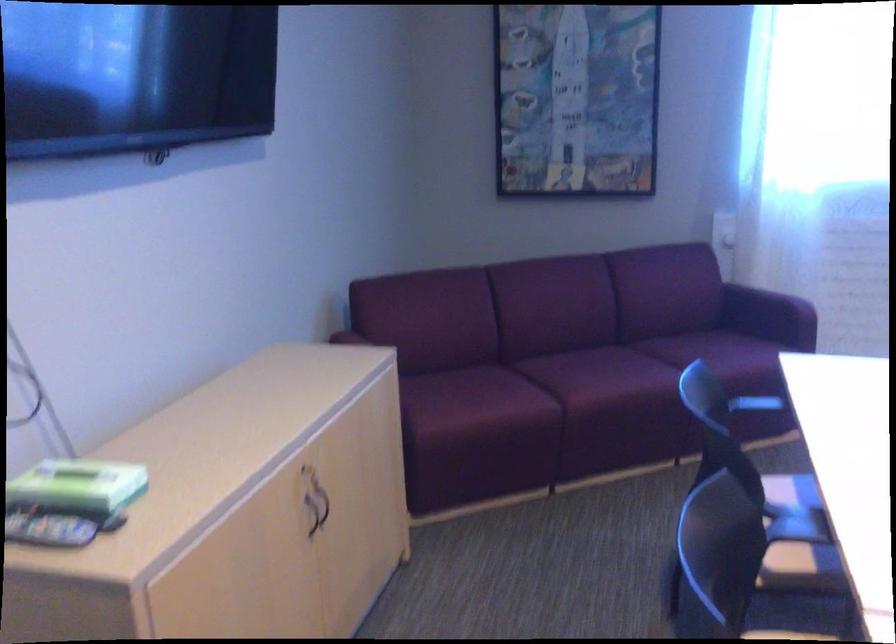
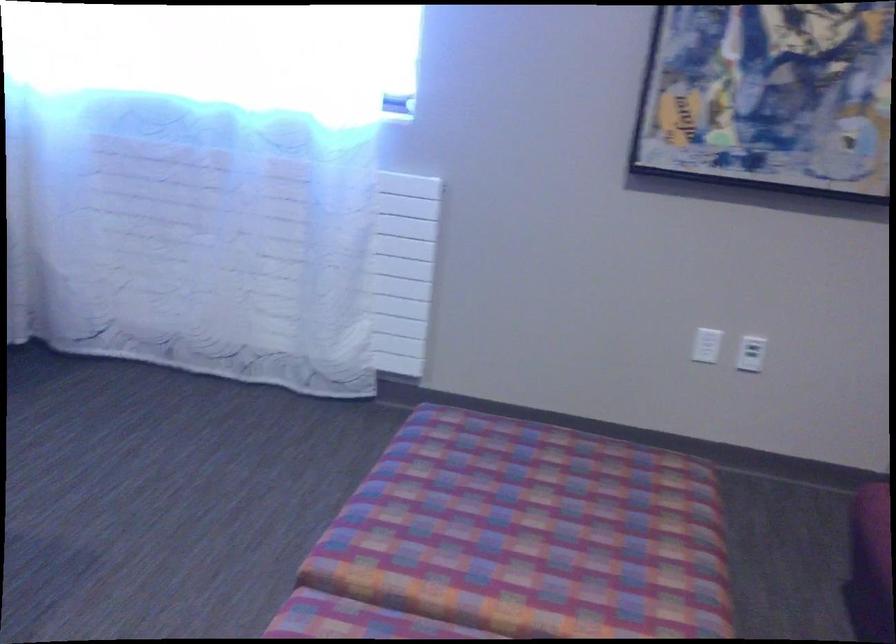
Question: What movement of the cameraman would produce the second image?

Choices:
 (A) Left
 (B) Right
 (C) Forward
 (D) Backward

Answer: (B)